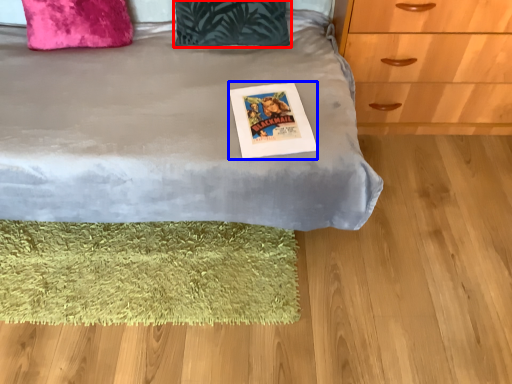
Question: Which object is closer to the camera taking this photo, pillow (highlighted by a red box) or postcard (highlighted by a blue box)?

Choices:
 (A) pillow
 (B) postcard

Answer: (B)